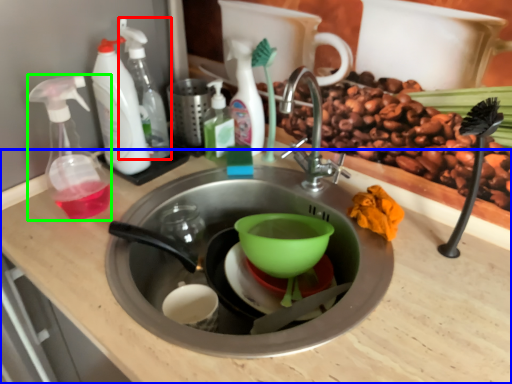
Question: Which object is positioned closest to cleaning product (highlighted by a red box)? Select from counter top (highlighted by a blue box) and soap dispenser (highlighted by a green box).

Choices:
 (A) counter top
 (B) soap dispenser

Answer: (B)